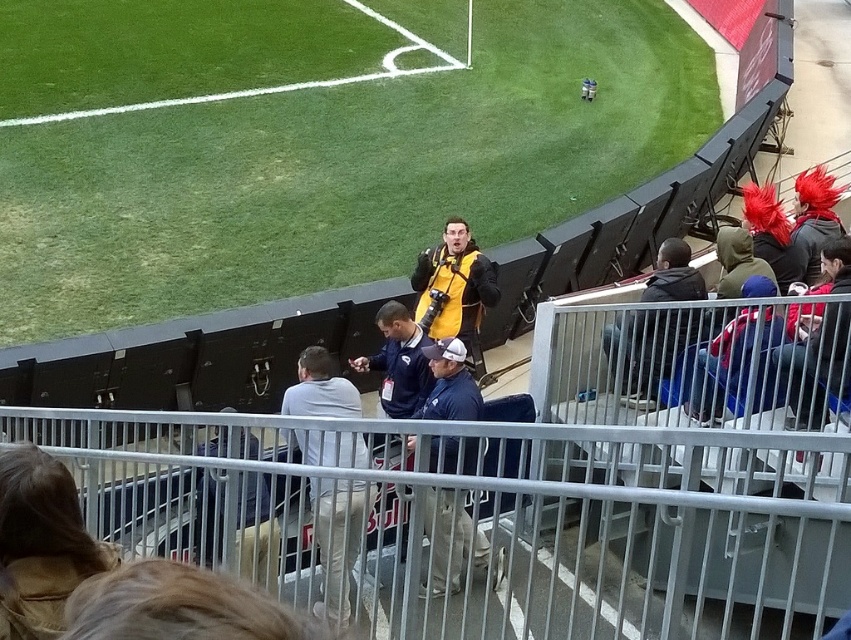
Question: Can you confirm if white matte pants at center is positioned below yellow matte vest at center?

Choices:
 (A) yes
 (B) no

Answer: (A)

Question: Which point is farther to the camera?

Choices:
 (A) brown leather jacket at lower left
 (B) white matte pants at center
 (C) dark blue jacket at center
 (D) metal at center

Answer: (D)

Question: Considering the relative positions of metal at center and brown leather jacket at lower left in the image provided, where is metal at center located with respect to brown leather jacket at lower left?

Choices:
 (A) right
 (B) left

Answer: (A)

Question: Which point is closer to the camera?

Choices:
 (A) brown leather jacket at lower left
 (B) green grass at center

Answer: (A)

Question: Which object is the farthest from the dark blue jacket at center?

Choices:
 (A) yellow matte vest at center
 (B) metal at center
 (C) dark blue jacket at right
 (D) green grass at center

Answer: (D)

Question: Is metal at center wider than white matte pants at center?

Choices:
 (A) yes
 (B) no

Answer: (B)